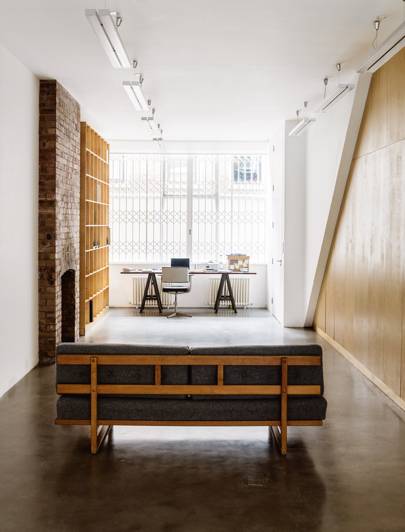
Locate an element on the screen. The image size is (405, 532). black sofa cushions is located at coordinates (121, 376), (241, 373), (151, 409).